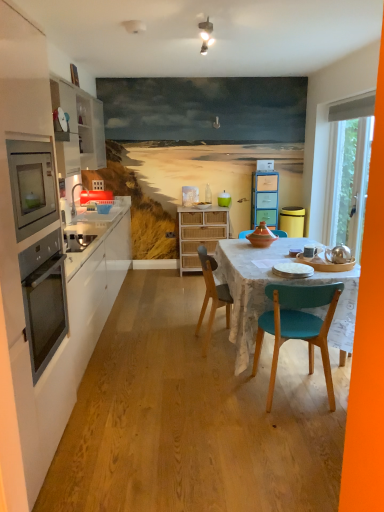
The image size is (384, 512). What are the coordinates of `white matte plate at center, the 2th plate viewed from the front` in the screenshot? It's located at (202, 205).

You are a GUI agent. You are given a task and a screenshot of the screen. Output one action in this format:
    pyautogui.click(x=<x>, y=<y>)
    Task: Click on the woven rattan cabinet at center, the 2th cabinetry in the right-to-left sequence
    
    Given the screenshot: What is the action you would take?
    pyautogui.click(x=200, y=234)

What do you see at coordinates (311, 251) in the screenshot? I see `white ceramic mug at table` at bounding box center [311, 251].

Locate an element on the screen. This screenshot has height=512, width=384. white ceramic mug at table is located at coordinates (311, 251).

The width and height of the screenshot is (384, 512). Find the location of `matte white plywood at center`. matte white plywood at center is located at coordinates (194, 417).

The width and height of the screenshot is (384, 512). I want to click on stainless steel oven at left, so 44,298.

Is point (220, 193) closer to camera compared to point (32, 230)?

No, it is behind (32, 230).

Is teal glossy jar at center not within stainless steel oven at left?

That's correct, teal glossy jar at center is outside of stainless steel oven at left.

Is teal glossy jar at center facing away from stainless steel oven at left?

teal glossy jar at center is not turned away from stainless steel oven at left.

From a real-world perspective, which is physically below, teal glossy jar at center or stainless steel oven at left?

teal glossy jar at center is physically lower.

Which is correct: green plastic drawers at center, arranged as the third cabinetry when viewed from the front, is inside matte white plywood at center, or outside of it?

green plastic drawers at center, arranged as the third cabinetry when viewed from the front, cannot be found inside matte white plywood at center.

From the image's perspective, which cabinetry is the 3rd one above the matte white plywood at center? Please provide its 2D coordinates.

[(264, 198)]

Who is shorter, green plastic drawers at center, the third cabinetry viewed from the left, or matte white plywood at center?

matte white plywood at center is shorter.

Is wooden chair at center positioned with its back to stainless steel oven at left?

No, wooden chair at center's orientation is not away from stainless steel oven at left.

From a real-world perspective, relative to stainless steel oven at left, is wooden chair at center vertically above or below?

wooden chair at center is situated lower than stainless steel oven at left in the real world.

Does wooden chair at center have a greater width compared to stainless steel oven at left?

Correct, the width of wooden chair at center exceeds that of stainless steel oven at left.

From the image's perspective, which one is positioned lower, wooden chair at center or stainless steel oven at left?

wooden chair at center, from the image's perspective.

From the image's perspective, would you say wooden chair at center is shown under matte white plywood at center?

No.

From a real-world perspective, is wooden chair at center physically located above or below matte white plywood at center?

wooden chair at center is situated higher than matte white plywood at center in the real world.

In the scene shown: Does wooden chair at center appear on the right side of matte white plywood at center?

Yes.

How distant is wooden chair at center from matte white plywood at center?

A distance of 26.86 inches exists between wooden chair at center and matte white plywood at center.

Is stainless steel oven at left next to wooden chair at center?

No, stainless steel oven at left is not touching wooden chair at center.

Which is behind, point (39, 158) or point (214, 290)?

The point (214, 290) is farther from the camera.

How many degrees apart are the facing directions of stainless steel oven at left and wooden chair at center?

They differ by 1.19 degrees in their facing directions.

Is stainless steel oven at left inside the boundaries of wooden chair at center, or outside?

stainless steel oven at left cannot be found inside wooden chair at center.

Between wooden chair at center and woven rattan cabinet at center, placed as the second cabinetry when sorted from front to back, which one appears on the right side from the viewer's perspective?

wooden chair at center is more to the right.

Which is behind, wooden chair at center or woven rattan cabinet at center, positioned as the 2th cabinetry in left-to-right order?

woven rattan cabinet at center, positioned as the 2th cabinetry in left-to-right order.

Who is smaller, wooden chair at center or woven rattan cabinet at center, the 2th cabinetry in the right-to-left sequence?

wooden chair at center.

Does white matte plate at center, placed as the 2th plate when sorted from right to left, have a greater height compared to transparent glass door at right?

Incorrect, the height of white matte plate at center, placed as the 2th plate when sorted from right to left, is not larger of that of transparent glass door at right.

From the picture: Is white matte plate at center, arranged as the 1th plate when viewed from the left, oriented towards transparent glass door at right?

No.

How much distance is there between white matte plate at center, the 2th plate viewed from the front, and transparent glass door at right?

A distance of 1.77 meters exists between white matte plate at center, the 2th plate viewed from the front, and transparent glass door at right.

Identify the location of plate behind the transparent glass door at right. This screenshot has width=384, height=512. (202, 205).

This screenshot has width=384, height=512. In order to click on teal above the stainless steel oven at left (from the image's perspective) in this screenshot , I will do `click(224, 199)`.

Find the location of `the 2nd cabinetry behind the matte white plywood at center, starting your count from the anchor`. the 2nd cabinetry behind the matte white plywood at center, starting your count from the anchor is located at coordinates (264, 198).

When comparing their distances from wooden chair at center, does green plastic drawers at center, arranged as the third cabinetry when viewed from the front, or stainless steel oven at left seem further?

The object further to wooden chair at center is green plastic drawers at center, arranged as the third cabinetry when viewed from the front.

When comparing their distances from white matte cabinet at left, the 1th cabinetry from the left, does stainless steel oven at left or matte red bowl at center seem further?

The object further to white matte cabinet at left, the 1th cabinetry from the left, is matte red bowl at center.

Considering their positions, is transparent glass door at right positioned closer to woven rattan cabinet at center, the second cabinetry viewed from the back, than white matte cabinet at left, the 1th cabinetry from the left?

The object closer to woven rattan cabinet at center, the second cabinetry viewed from the back, is transparent glass door at right.

When comparing their distances from white matte cabinet at left, the 1th cabinetry from the left, does white plastic microwave at upper center or matte red bowl at center seem closer?

matte red bowl at center.

In the scene shown: From the image, which object appears to be nearer to wooden chair at center, translucent glass bottle at center or yellow matte trash bin/can at right?

translucent glass bottle at center is closer to wooden chair at center.

From the image, which object appears to be nearer to transparent glass door at right, woven rattan cabinet at center, the 2th cabinetry in the right-to-left sequence, or matte white plywood at center?

woven rattan cabinet at center, the 2th cabinetry in the right-to-left sequence, is positioned closer to the anchor transparent glass door at right.

Considering their positions, is white matte cabinet at left, the 1th cabinetry in the front-to-back sequence, positioned closer to green plastic drawers at center, the third cabinetry viewed from the left, than yellow matte trash bin/can at right?

Based on the image, yellow matte trash bin/can at right appears to be nearer to green plastic drawers at center, the third cabinetry viewed from the left.

When comparing their distances from stainless steel oven at left, does teal glossy jar at center or transparent glass door at right seem closer?

transparent glass door at right is closer to stainless steel oven at left.

I want to click on exhaust hood located between white matte cabinet at left, the 1th cabinetry in the front-to-back sequence, and green plastic drawers at center, the first cabinetry positioned from the back, in the depth direction, so click(x=352, y=109).

At what (x,y) coordinates should I click in order to perform the action: click on oven positioned between white matte cabinet at left, the 3th cabinetry positioned from the right, and woven rattan cabinet at center, the 2th cabinetry in the right-to-left sequence, from near to far. Please return your answer as a coordinate pair (x, y). This screenshot has height=512, width=384. Looking at the image, I should click on (44, 298).

Where is `plate positioned between transparent glass door at right and white plastic microwave at upper center from near to far`? The image size is (384, 512). plate positioned between transparent glass door at right and white plastic microwave at upper center from near to far is located at coordinates point(202,205).

Identify the location of exhaust hood positioned between stainless steel oven at left and matte red bowl at center from near to far. (352, 109).